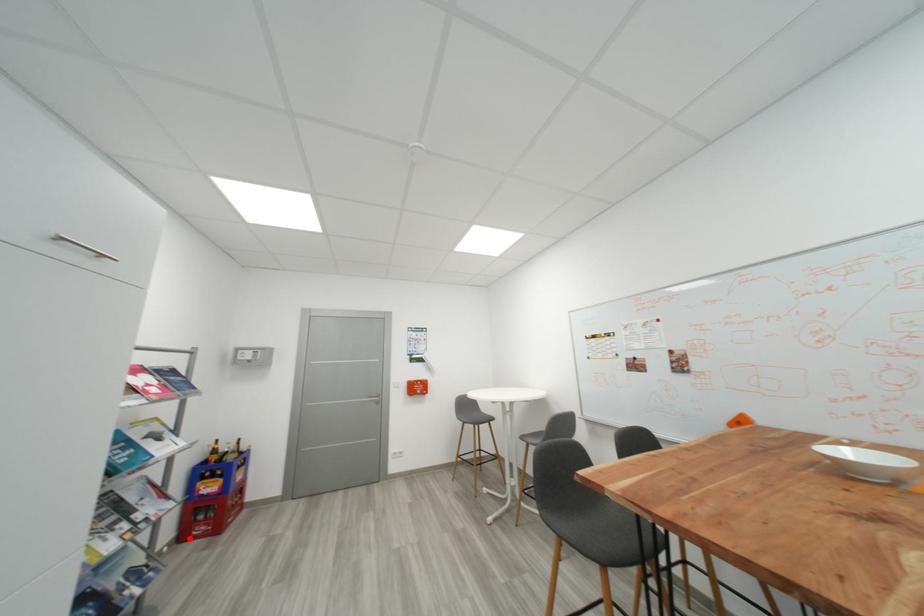
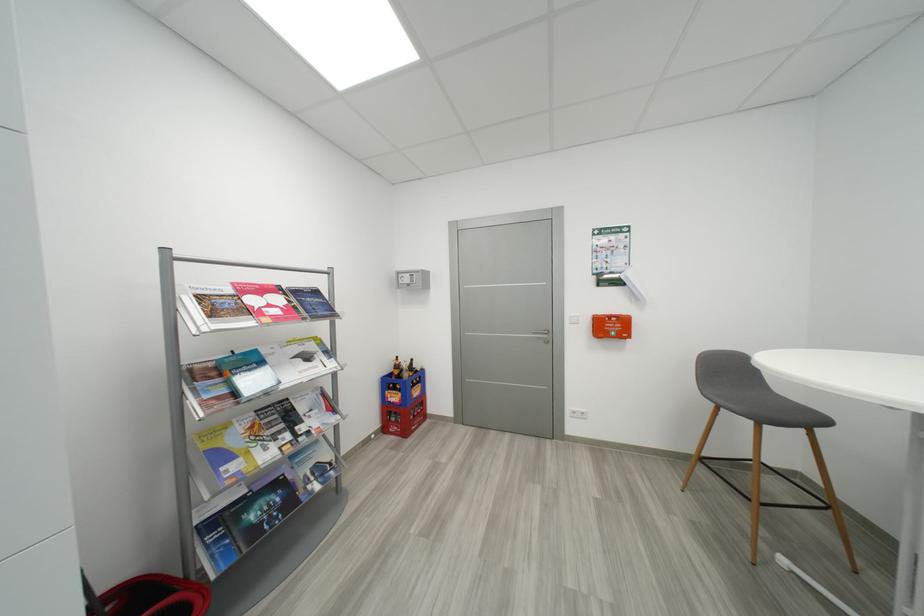
Question: I am providing you with two images of the same scene from different viewpoints. A red point is shown in image1. For the corresponding object point in image2, is it positioned nearer or farther from the camera?

Choices:
 (A) Nearer
 (B) Farther

Answer: (B)